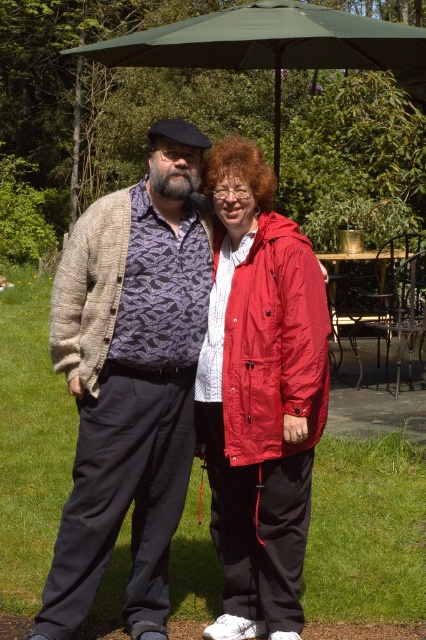
Is matte red jacket at center thinner than green fabric umbrella at upper center?

Yes, matte red jacket at center is thinner than green fabric umbrella at upper center.

Can you confirm if matte red jacket at center is positioned to the left of green fabric umbrella at upper center?

Incorrect, matte red jacket at center is not on the left side of green fabric umbrella at upper center.

At what (x,y) coordinates should I click in order to perform the action: click on matte red jacket at center. Please return your answer as a coordinate pair (x, y). This screenshot has width=426, height=640. Looking at the image, I should click on (x=259, y=396).

Is point (221, 518) closer to viewer compared to point (383, 317)?

Yes.

Is matte red jacket at center further to camera compared to metallic wrought iron picnic table at center?

That is False.

In order to click on matte red jacket at center in this screenshot , I will do 259,396.

Is knitted beige sweater at left wider than green fabric umbrella at upper center?

In fact, knitted beige sweater at left might be narrower than green fabric umbrella at upper center.

Between knitted beige sweater at left and green fabric umbrella at upper center, which one is positioned higher?

green fabric umbrella at upper center is higher up.

Does point (134, 248) come in front of point (290, 60)?

Yes.

Where is `knitted beige sweater at left`? knitted beige sweater at left is located at coordinates (129, 380).